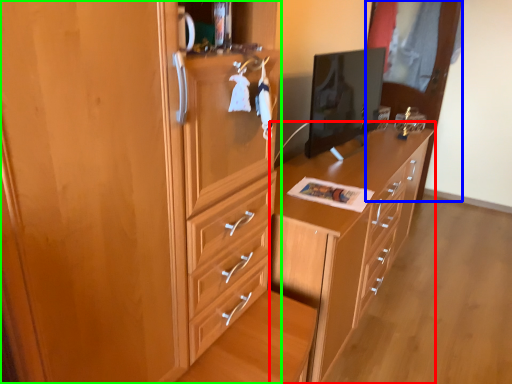
Question: Which object is the closest to the chest of drawers (highlighted by a red box)? Choose among these: glass door (highlighted by a blue box) or cabinetry (highlighted by a green box).

Choices:
 (A) glass door
 (B) cabinetry

Answer: (B)